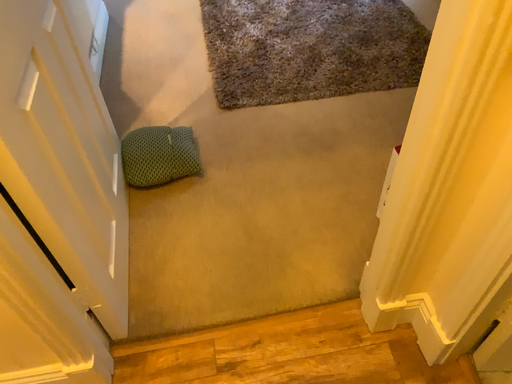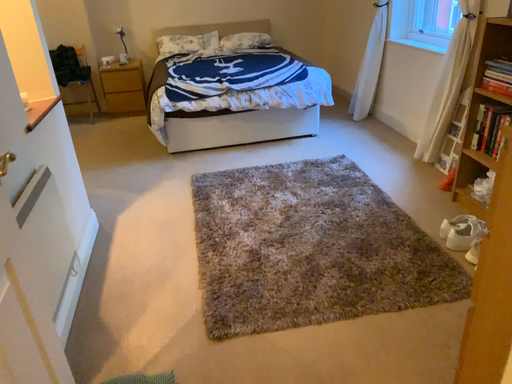
Question: Which way did the camera rotate in the video?

Choices:
 (A) rotated downward
 (B) rotated upward

Answer: (B)